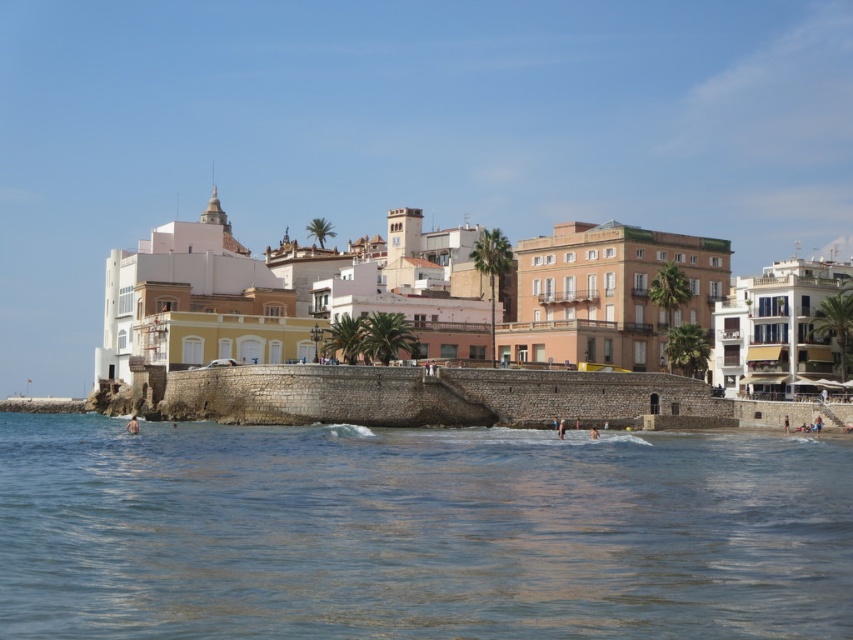
Question: Which of the following is the closest to the observer?

Choices:
 (A) clear blue water at lower center
 (B) yellow stucco buildings at center

Answer: (A)

Question: Does clear blue water at lower center appear under yellow stucco buildings at center?

Choices:
 (A) no
 (B) yes

Answer: (B)

Question: Which point is closer to the camera?

Choices:
 (A) (474, 273)
 (B) (604, 564)

Answer: (B)

Question: Does clear blue water at lower center appear over yellow stucco buildings at center?

Choices:
 (A) yes
 (B) no

Answer: (B)

Question: Observing the image, what is the correct spatial positioning of clear blue water at lower center in reference to yellow stucco buildings at center?

Choices:
 (A) below
 (B) above

Answer: (A)